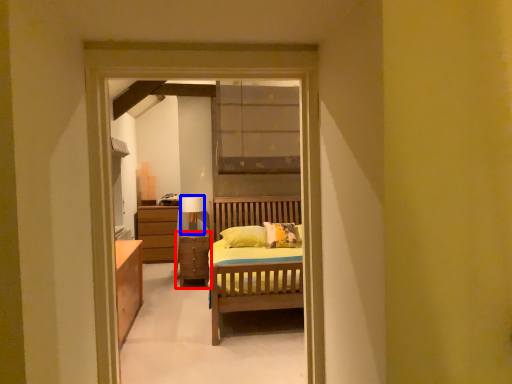
Question: Which object is further to the camera taking this photo, chest of drawers (highlighted by a red box) or table lamp (highlighted by a blue box)?

Choices:
 (A) chest of drawers
 (B) table lamp

Answer: (B)